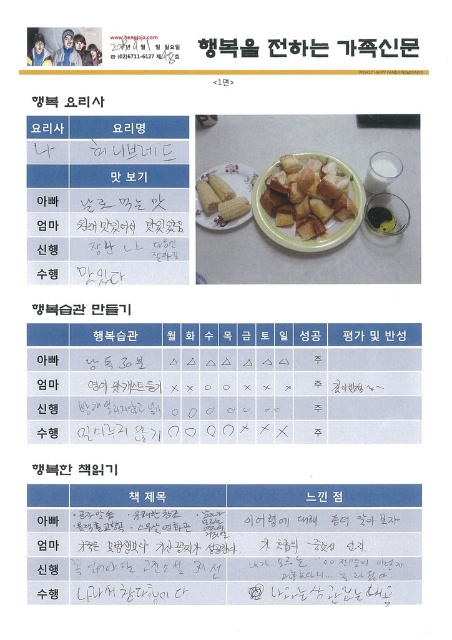
You are a photographer standing 3 feet away from the golden brown croutons at center in the Weekly Happy Family Newspaper image. Can you capture a clear closeup shot of the croutons without moving closer?

The golden brown croutons at center are 3.31 feet away from the viewer. Since you are already 3 feet away, you can capture a clear closeup shot without moving closer as the distance is sufficient.

You are designing a layout for the Weekly Happy Family Newspaper and need to place both the golden brown croutons at center and the yellow matte corn at center in the top section. Based on their widths, which object should be placed first to ensure they both fit?

The golden brown croutons at center might be wider than yellow matte corn at center, so it should be placed first to accommodate its width.